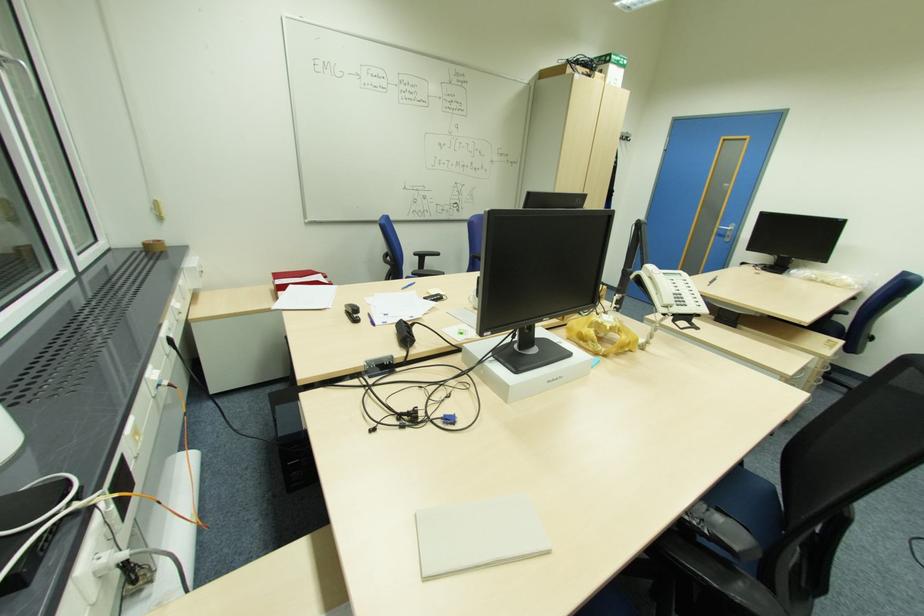
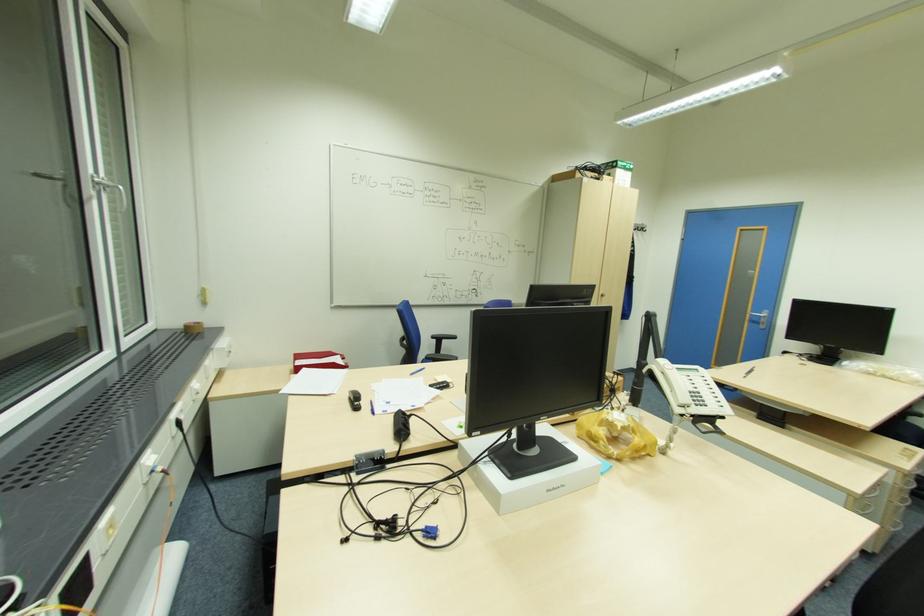
Find the pixel in the second image that matches pixel 732 236 in the first image.

(766, 323)